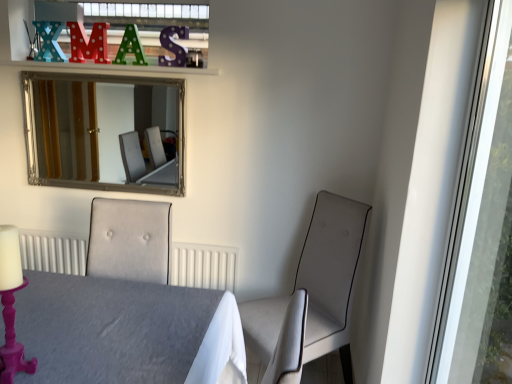
Question: Considering the relative sizes of silver/glass mirror at upper left and pink painted wood candle holder at lower left in the image provided, is silver/glass mirror at upper left shorter than pink painted wood candle holder at lower left?

Choices:
 (A) yes
 (B) no

Answer: (B)

Question: Would you say pink painted wood candle holder at lower left is part of silver/glass mirror at upper left's contents?

Choices:
 (A) yes
 (B) no

Answer: (B)

Question: From a real-world perspective, is silver/glass mirror at upper left beneath pink painted wood candle holder at lower left?

Choices:
 (A) yes
 (B) no

Answer: (B)

Question: Is silver/glass mirror at upper left to the left of pink painted wood candle holder at lower left from the viewer's perspective?

Choices:
 (A) yes
 (B) no

Answer: (A)

Question: Is silver/glass mirror at upper left looking in the opposite direction of pink painted wood candle holder at lower left?

Choices:
 (A) yes
 (B) no

Answer: (B)

Question: Is silver/glass mirror at upper left smaller than pink painted wood candle holder at lower left?

Choices:
 (A) yes
 (B) no

Answer: (B)

Question: Considering the relative sizes of transparent glass window at right and polka dot wooden letter m at upper center, which is the 2th alphabet in right-to-left order, in the image provided, is transparent glass window at right wider than polka dot wooden letter m at upper center, which is the 2th alphabet in right-to-left order,?

Choices:
 (A) yes
 (B) no

Answer: (A)

Question: Can you confirm if transparent glass window at right is positioned to the right of polka dot wooden letter m at upper center, the 2th alphabet in the left-to-right sequence?

Choices:
 (A) yes
 (B) no

Answer: (A)

Question: Does transparent glass window at right have a smaller size compared to polka dot wooden letter m at upper center, the 2th alphabet in the left-to-right sequence?

Choices:
 (A) no
 (B) yes

Answer: (A)

Question: Considering the relative sizes of transparent glass window at right and polka dot wooden letter m at upper center, which is the 2th alphabet in right-to-left order, in the image provided, is transparent glass window at right taller than polka dot wooden letter m at upper center, which is the 2th alphabet in right-to-left order,?

Choices:
 (A) no
 (B) yes

Answer: (B)

Question: From a real-world perspective, is transparent glass window at right positioned under polka dot wooden letter m at upper center, the 2th alphabet in the left-to-right sequence, based on gravity?

Choices:
 (A) yes
 (B) no

Answer: (A)

Question: Does transparent glass window at right contain polka dot wooden letter m at upper center, the 2th alphabet in the left-to-right sequence?

Choices:
 (A) no
 (B) yes

Answer: (A)

Question: Is green polka dot letter a at upper center, the third alphabet in the left-to-right sequence, beside transparent glass window at right?

Choices:
 (A) no
 (B) yes

Answer: (A)